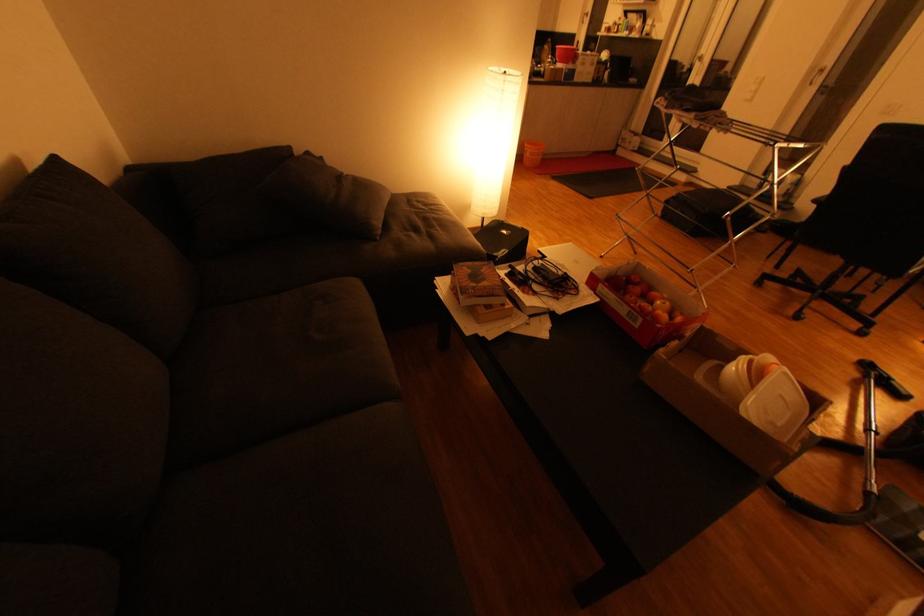
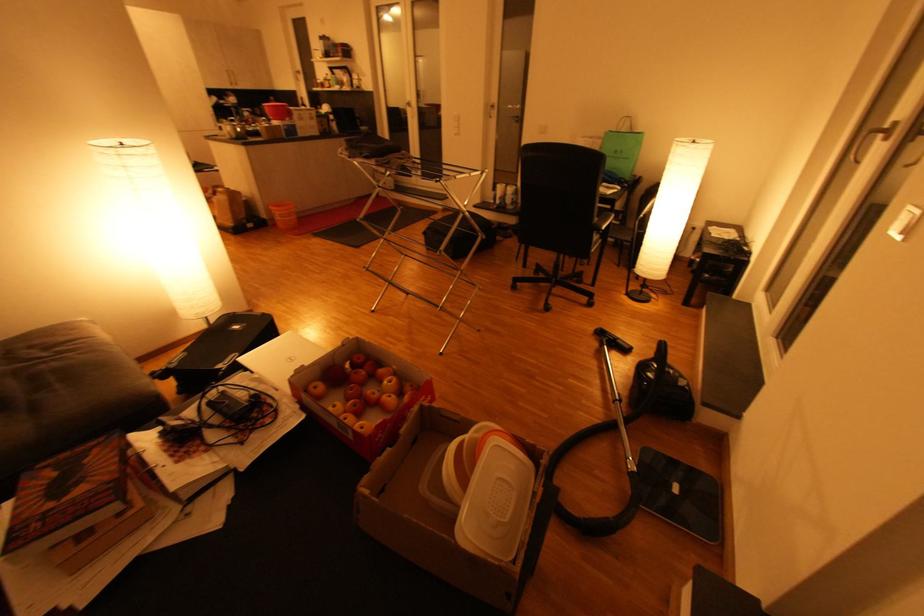
Locate, in the second image, the point that corresponds to the point at 531,156 in the first image.

(282, 219)